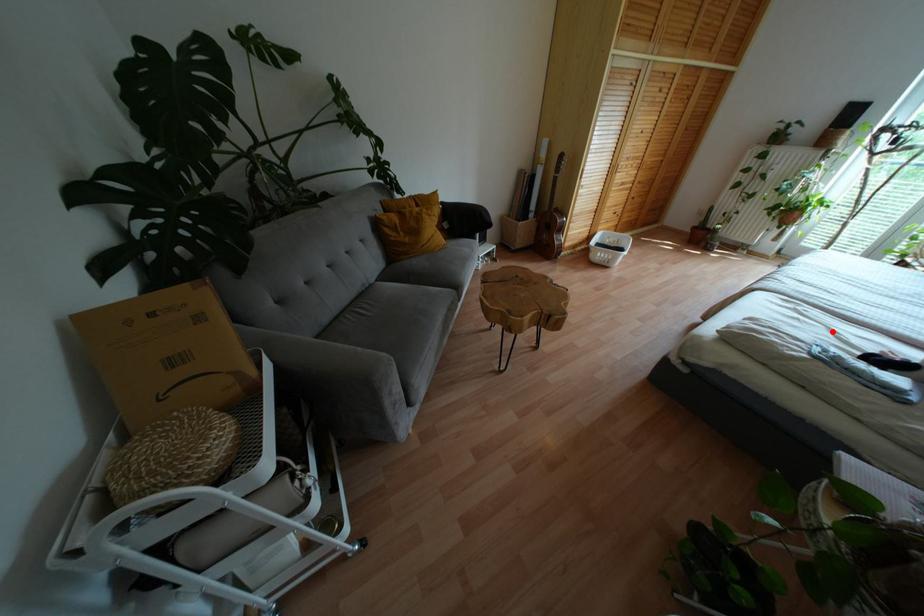
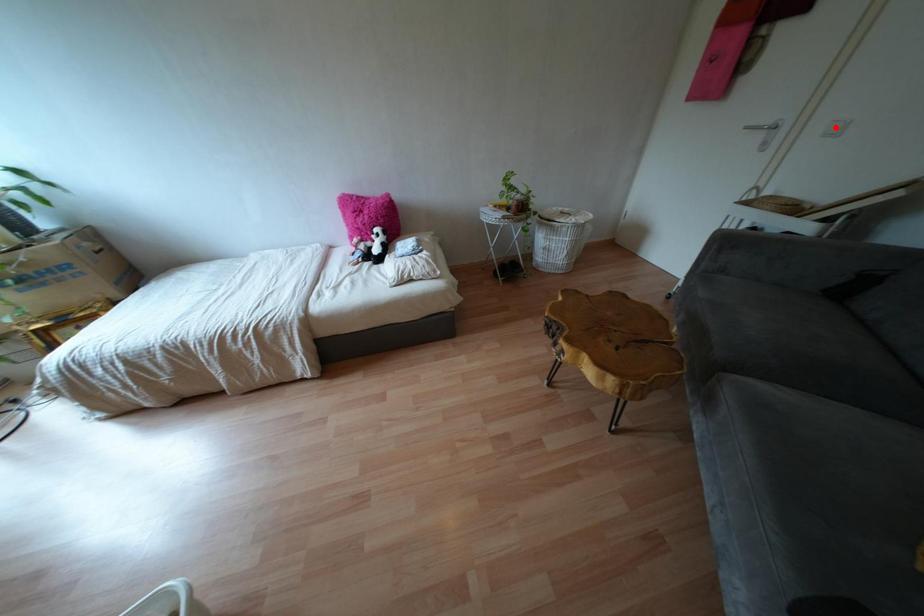
I am providing you with two images of the same scene from different viewpoints. A red point is marked on the first image and another point is marked on the second image. Does the point marked in image1 correspond to the same location as the one in image2?

No